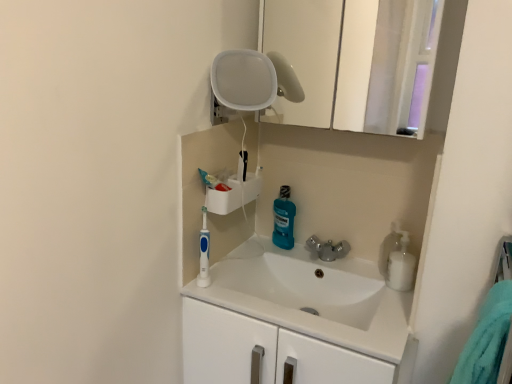
Question: From a real-world perspective, is blue glossy mouthwash at center, acting as the 1th cleaning product starting from the back, above or below white glossy medicine cabinet at upper center?

Choices:
 (A) below
 (B) above

Answer: (A)

Question: From the image's perspective, is blue glossy mouthwash at center, which is the 2th cleaning product in front-to-back order, above or below white glossy medicine cabinet at upper center?

Choices:
 (A) below
 (B) above

Answer: (A)

Question: Which is nearer to the blue glossy mouthwash at center, acting as the 1th cleaning product starting from the back?

Choices:
 (A) white glossy bottle at right, which is the second cleaning product in back-to-front order
 (B) white glossy medicine cabinet at upper center
 (C) white glossy sink at center
 (D) teal soft towel at right
 (E) blue plastic toothbrush at center-left

Answer: (C)

Question: Which of these objects is positioned farthest from the blue plastic toothbrush at center-left?

Choices:
 (A) white glossy sink at center
 (B) blue glossy mouthwash at center, marked as the 1th cleaning product in a left-to-right arrangement
 (C) teal soft towel at right
 (D) white glossy bottle at right, the 1th cleaning product from the right
 (E) white glossy medicine cabinet at upper center

Answer: (E)